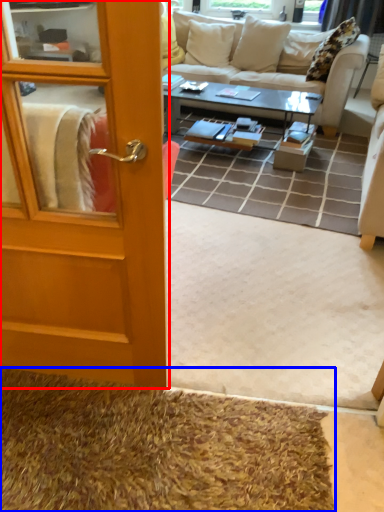
Question: Which object is closer to the camera taking this photo, door (highlighted by a red box) or doormat (highlighted by a blue box)?

Choices:
 (A) door
 (B) doormat

Answer: (A)